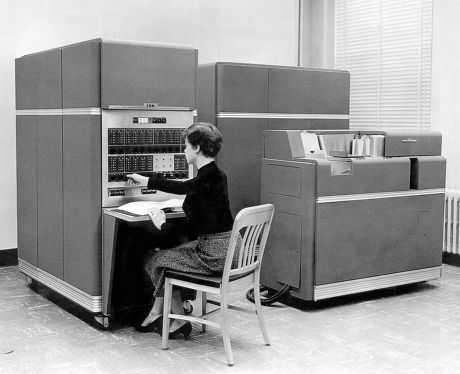
At what (x,y) coordinates should I click in order to perform the action: click on chair. Please return your answer as a coordinate pair (x, y). Looking at the image, I should click on (258, 216).